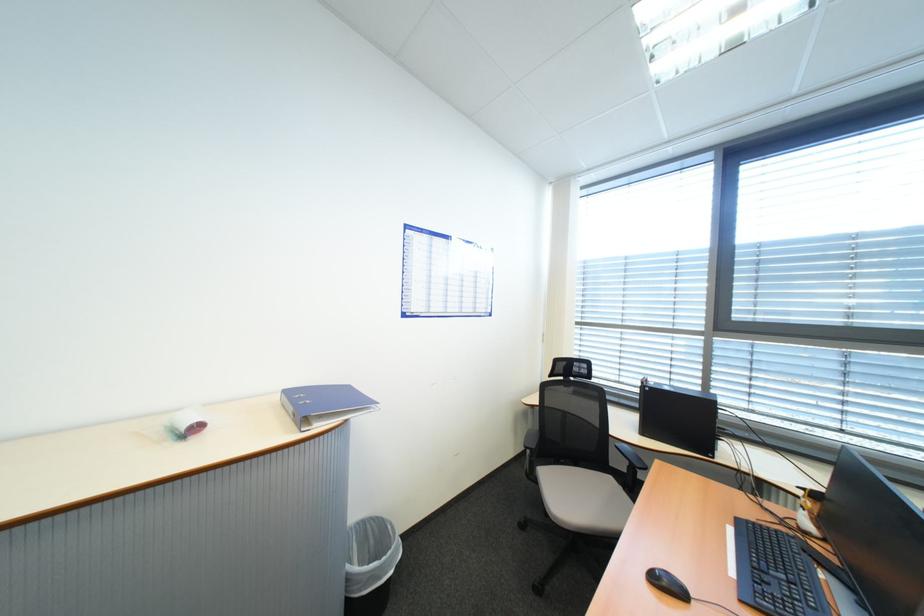
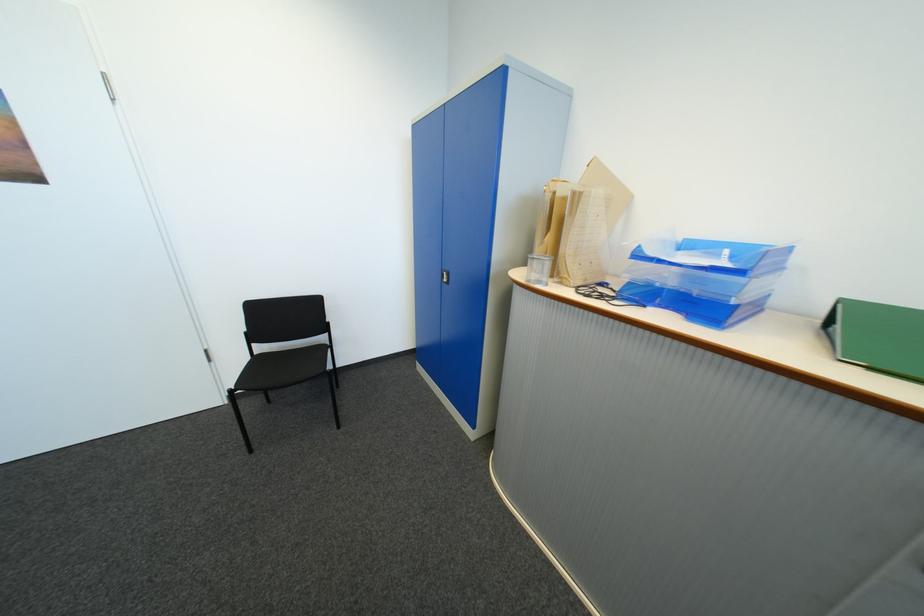
First-person continuous shooting, in which direction is the camera rotating?

The camera rotated toward left-down.